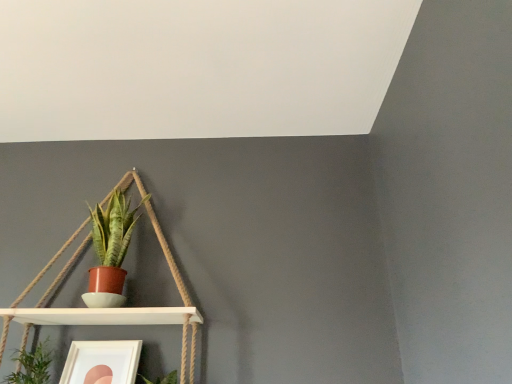
Question: Considering the positions of white matte picture frame at lower left and matte terracotta pot at center-left, the second houseplant in the bottom-to-top sequence, in the image, is white matte picture frame at lower left wider or thinner than matte terracotta pot at center-left, the second houseplant in the bottom-to-top sequence,?

Choices:
 (A) wide
 (B) thin

Answer: (A)

Question: From the image's perspective, relative to matte terracotta pot at center-left, positioned as the 2th houseplant in left-to-right order, is white matte picture frame at lower left above or below?

Choices:
 (A) below
 (B) above

Answer: (A)

Question: Based on their relative distances, which object is nearer to the green leafy plant at lower left, which is the second houseplant from top to bottom?

Choices:
 (A) white matte shelf at left
 (B) matte terracotta pot at center-left, positioned as the 2th houseplant in left-to-right order
 (C) white matte picture frame at lower left

Answer: (C)

Question: Estimate the real-world distances between objects in this image. Which object is farther from the green leafy plant at lower left, the first houseplant in the left-to-right sequence?

Choices:
 (A) matte terracotta pot at center-left, positioned as the 2th houseplant in left-to-right order
 (B) white matte picture frame at lower left
 (C) white matte shelf at left

Answer: (A)